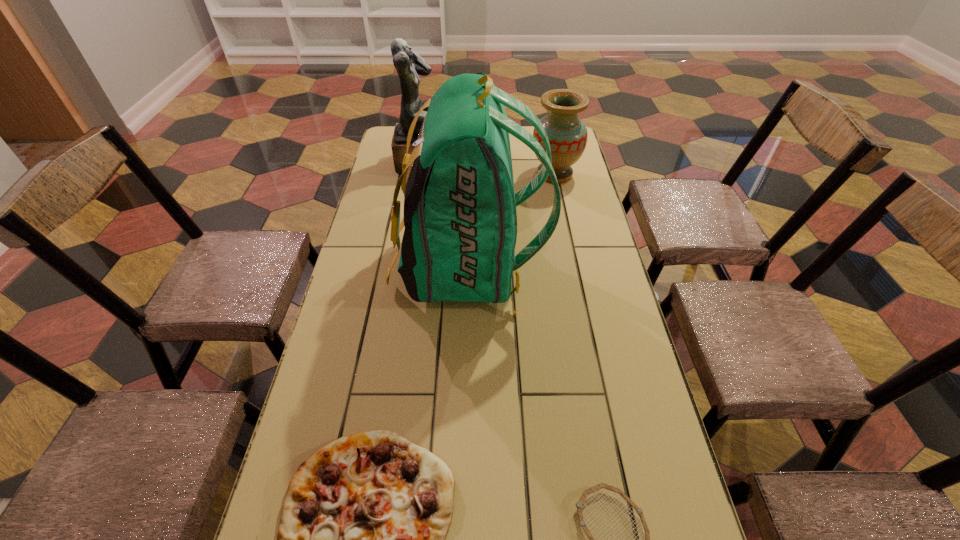
This screenshot has height=540, width=960. In order to click on free space that satisfies the following two spatial constraints: 1. on the front side of the vase; 2. on the back of the tallest object in this screenshot , I will do `click(574, 267)`.